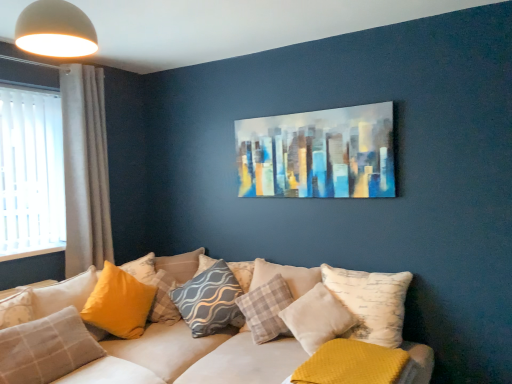
Question: From the image's perspective, is gray textured pillow at center, the 4th pillow from the right, positioned above or below white textured pillow at center, the eighth pillow from the left?

Choices:
 (A) below
 (B) above

Answer: (B)

Question: Considering the positions of gray textured pillow at center, the 4th pillow from the right, and white textured pillow at center, the 2th pillow positioned from the right, in the image, is gray textured pillow at center, the 4th pillow from the right, wider or thinner than white textured pillow at center, the 2th pillow positioned from the right,?

Choices:
 (A) thin
 (B) wide

Answer: (A)

Question: Estimate the real-world distances between objects in this image. Which object is farther from the abstract painting at upper center?

Choices:
 (A) mustard yellow textured pillow at lower right, which ranks as the 1th pillow in right-to-left order
 (B) plaid fabric pillow at center, which ranks as the 3th pillow in right-to-left order
 (C) white matte dome at upper left
 (D) velvet white couch at lower center
 (E) white textured pillow at center, the eighth pillow from the left

Answer: (C)

Question: Considering the real-world distances, which object is closest to the yellow fabric pillow at lower left, which is counted as the 9th pillow, starting from the right?

Choices:
 (A) yellow fabric pillow at lower left, which is the 8th pillow in right-to-left order
 (B) gray textured pillow at center, the sixth pillow in the left-to-right sequence
 (C) yellow fabric pillow at center, placed as the fourth pillow when sorted from left to right
 (D) plaid fabric pillow at center, which ranks as the seventh pillow in left-to-right order
 (E) gray wavy-patterned pillow at center, which is the 5th pillow from left to right

Answer: (A)